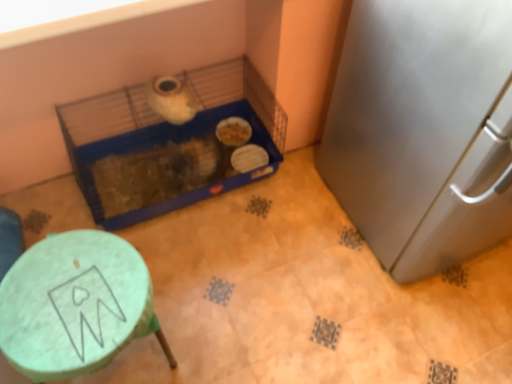
Question: Considering the relative positions of satin silver refrigerator at right and dark brown textured bedding at center in the image provided, is satin silver refrigerator at right behind dark brown textured bedding at center?

Choices:
 (A) yes
 (B) no

Answer: (B)

Question: Considering the relative positions of satin silver refrigerator at right and dark brown textured bedding at center in the image provided, is satin silver refrigerator at right to the right of dark brown textured bedding at center from the viewer's perspective?

Choices:
 (A) yes
 (B) no

Answer: (A)

Question: Is satin silver refrigerator at right not within dark brown textured bedding at center?

Choices:
 (A) yes
 (B) no

Answer: (A)

Question: Considering the relative sizes of satin silver refrigerator at right and dark brown textured bedding at center in the image provided, is satin silver refrigerator at right bigger than dark brown textured bedding at center?

Choices:
 (A) no
 (B) yes

Answer: (B)

Question: Could you tell me if satin silver refrigerator at right is turned towards dark brown textured bedding at center?

Choices:
 (A) no
 (B) yes

Answer: (A)

Question: Is green matte stool at lower left taller or shorter than satin silver refrigerator at right?

Choices:
 (A) tall
 (B) short

Answer: (B)

Question: In terms of width, does green matte stool at lower left look wider or thinner when compared to satin silver refrigerator at right?

Choices:
 (A) wide
 (B) thin

Answer: (B)

Question: Is green matte stool at lower left bigger or smaller than satin silver refrigerator at right?

Choices:
 (A) small
 (B) big

Answer: (A)

Question: Considering the positions of point (67, 246) and point (352, 51), is point (67, 246) closer or farther from the camera than point (352, 51)?

Choices:
 (A) farther
 (B) closer

Answer: (B)

Question: From the image's perspective, is blue plastic bird cage at center located above or below satin silver refrigerator at right?

Choices:
 (A) below
 (B) above

Answer: (A)

Question: In the image, is blue plastic bird cage at center positioned in front of or behind satin silver refrigerator at right?

Choices:
 (A) front
 (B) behind

Answer: (B)

Question: Is blue plastic bird cage at center bigger or smaller than satin silver refrigerator at right?

Choices:
 (A) small
 (B) big

Answer: (A)

Question: Visually, is blue plastic bird cage at center positioned to the left or to the right of satin silver refrigerator at right?

Choices:
 (A) right
 (B) left

Answer: (B)

Question: Is point (164, 167) closer or farther from the camera than point (128, 178)?

Choices:
 (A) farther
 (B) closer

Answer: (B)

Question: Considering the positions of blue plastic bird cage at center and dark brown textured bedding at center in the image, is blue plastic bird cage at center bigger or smaller than dark brown textured bedding at center?

Choices:
 (A) big
 (B) small

Answer: (A)